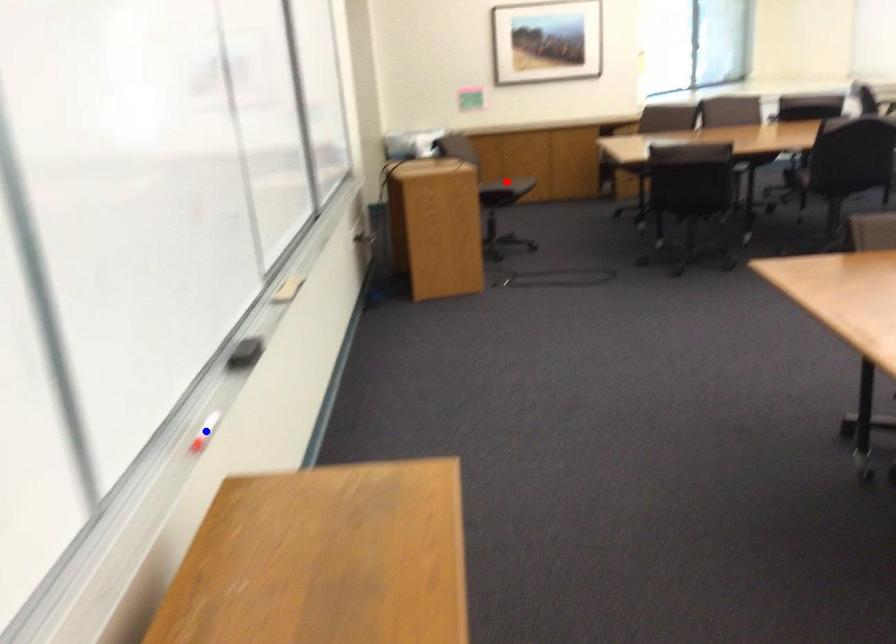
Question: In the image, two points are highlighted. Which point is nearer to the camera? Reply with the corresponding letter.

Choices:
 (A) blue point
 (B) red point

Answer: (A)